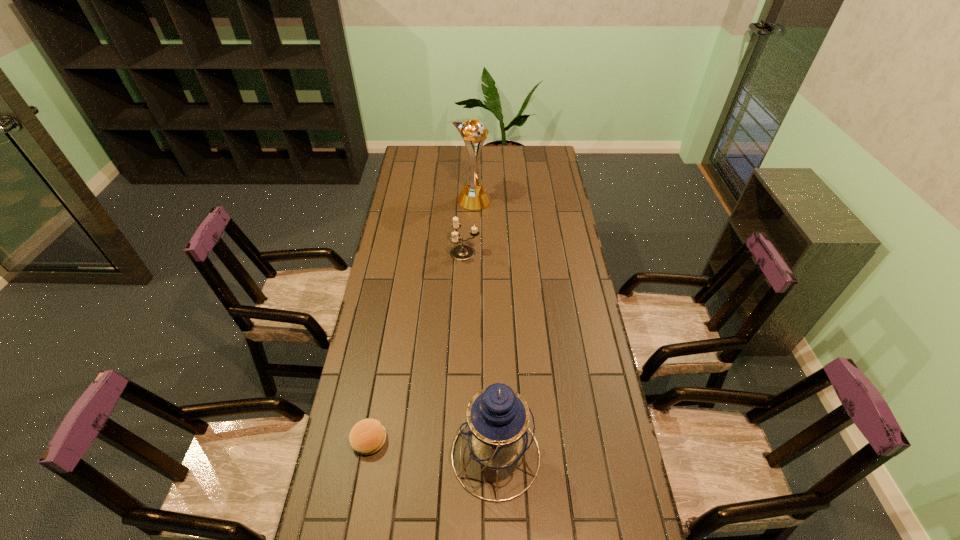
The height and width of the screenshot is (540, 960). What are the coordinates of `blank region between the trophy and the candle holder` in the screenshot? It's located at (468, 227).

I want to click on vacant area that lies between the trophy and the second farthest object, so click(468, 227).

Identify the location of free space between the third nearest object and the trophy. Image resolution: width=960 pixels, height=540 pixels. (468, 227).

The width and height of the screenshot is (960, 540). I want to click on vacant area between the candle holder and the trophy, so click(x=468, y=227).

You are a GUI agent. You are given a task and a screenshot of the screen. Output one action in this format:
    pyautogui.click(x=<x>, y=<y>)
    Task: Click on the unoccupied position between the third tallest object and the farthest object
    The height and width of the screenshot is (540, 960).
    Given the screenshot: What is the action you would take?
    pyautogui.click(x=468, y=227)

Locate an element on the screen. This screenshot has width=960, height=540. free area in between the second farthest object and the trophy is located at coordinates (468, 227).

At what (x,y) coordinates should I click in order to perform the action: click on object that is the closest to the trophy. Please return your answer as a coordinate pair (x, y). Looking at the image, I should click on (462, 252).

Identify the location of the closest object to the leftmost object. (497, 429).

Identify the location of free point that satisfies the following two spatial constraints: 1. on the front-facing side of the farthest object; 2. on the front side of the third tallest object. (472, 253).

Find the location of a particular element. The width and height of the screenshot is (960, 540). free space that satisfies the following two spatial constraints: 1. on the front-facing side of the farthest object; 2. on the front side of the shortest object is located at coordinates (468, 440).